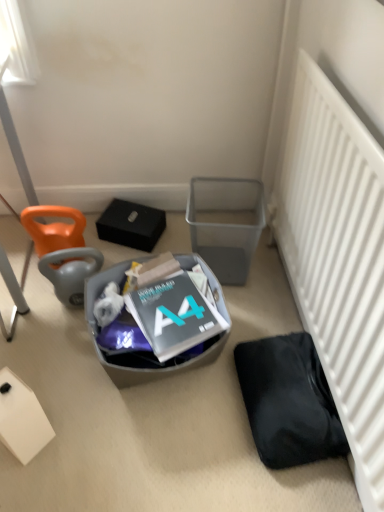
Question: Which direction should I rotate to look at translucent plastic trash bin at center, positioned as the second trash bin/can in right-to-left order?

Choices:
 (A) left
 (B) right

Answer: (A)

Question: From the image's perspective, is metallic gray trash bin at center right, the 1th trash bin/can when ordered from right to left, on black matte bag at lower right?

Choices:
 (A) yes
 (B) no

Answer: (A)

Question: From a real-world perspective, is metallic gray trash bin at center right, the 2th trash bin/can in the left-to-right sequence, under black matte bag at lower right?

Choices:
 (A) no
 (B) yes

Answer: (A)

Question: Is metallic gray trash bin at center right, the 1th trash bin/can when ordered from right to left, bigger than black matte bag at lower right?

Choices:
 (A) no
 (B) yes

Answer: (B)

Question: Can you confirm if metallic gray trash bin at center right, the 1th trash bin/can when ordered from right to left, is shorter than black matte bag at lower right?

Choices:
 (A) no
 (B) yes

Answer: (A)

Question: Does metallic gray trash bin at center right, the 1th trash bin/can when ordered from right to left, have a greater height compared to black matte bag at lower right?

Choices:
 (A) yes
 (B) no

Answer: (A)

Question: Does metallic gray trash bin at center right, the 1th trash bin/can when ordered from right to left, touch black matte bag at lower right?

Choices:
 (A) no
 (B) yes

Answer: (A)

Question: Does orange fabric bean bag chair at left, positioned as the first bean bag chair in bottom-to-top order, touch white matte box at lower left?

Choices:
 (A) yes
 (B) no

Answer: (B)

Question: Is orange fabric bean bag chair at left, positioned as the first bean bag chair in bottom-to-top order, at the left side of white matte box at lower left?

Choices:
 (A) yes
 (B) no

Answer: (B)

Question: Can you confirm if orange fabric bean bag chair at left, which ranks as the second bean bag chair in top-to-bottom order, is shorter than white matte box at lower left?

Choices:
 (A) yes
 (B) no

Answer: (A)

Question: Is orange fabric bean bag chair at left, positioned as the first bean bag chair in bottom-to-top order, at the right side of white matte box at lower left?

Choices:
 (A) no
 (B) yes

Answer: (B)

Question: From a real-world perspective, is orange fabric bean bag chair at left, positioned as the first bean bag chair in bottom-to-top order, located higher than white matte box at lower left?

Choices:
 (A) yes
 (B) no

Answer: (A)

Question: Does orange fabric bean bag chair at left, positioned as the first bean bag chair in bottom-to-top order, have a larger size compared to white matte box at lower left?

Choices:
 (A) no
 (B) yes

Answer: (B)

Question: Is white matte box at lower left in contact with white matte radiator at lower right?

Choices:
 (A) yes
 (B) no

Answer: (B)